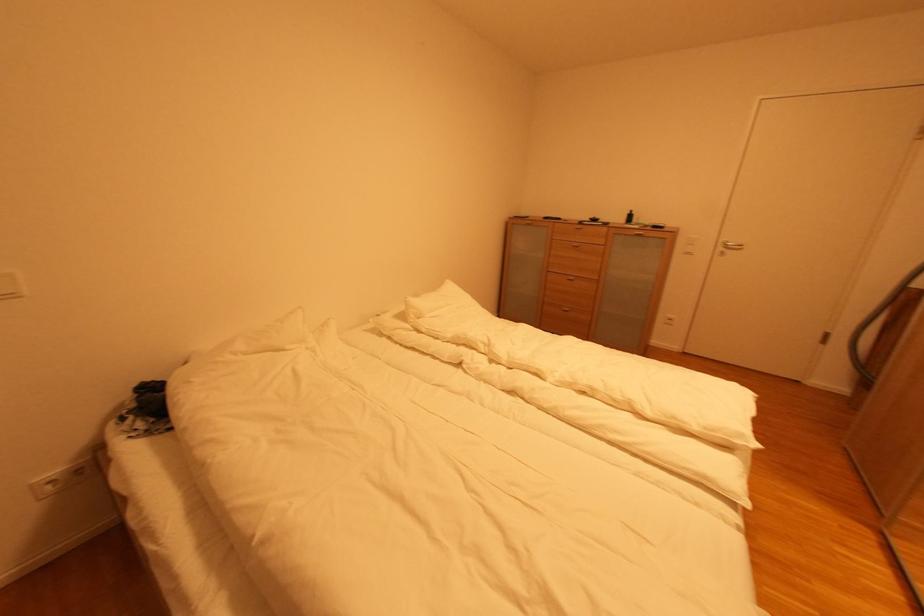
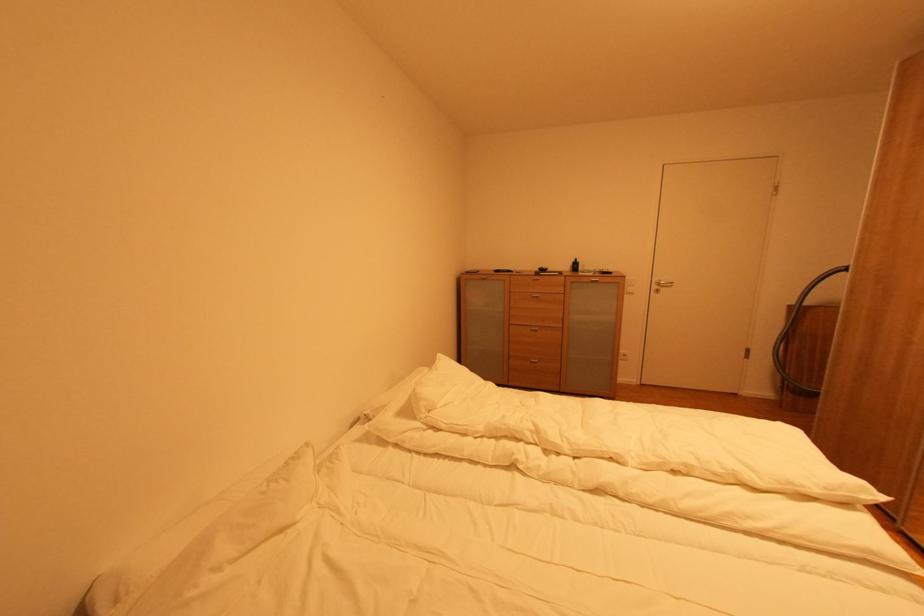
Question: The first image is from the beginning of the video and the second image is from the end. How did the camera likely rotate when shooting the video?

Choices:
 (A) Left
 (B) Right
 (C) Up
 (D) Down

Answer: (B)